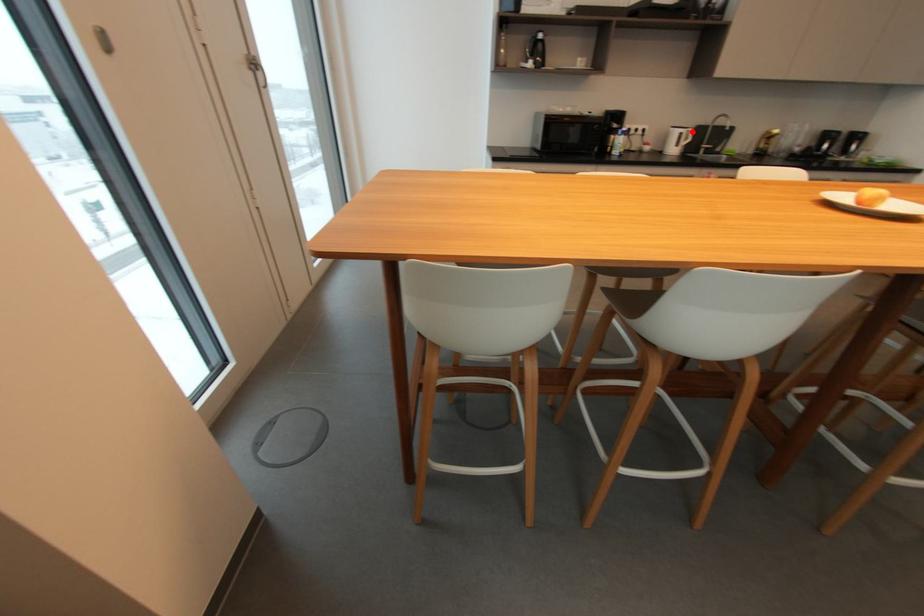
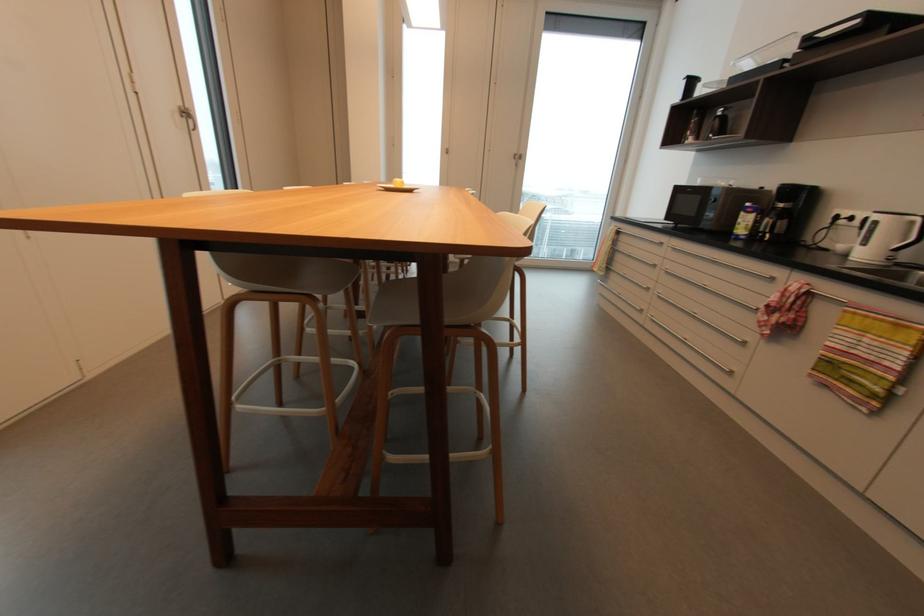
In the second image, find the point that corresponds to the highlighted location in the first image.

(916, 223)